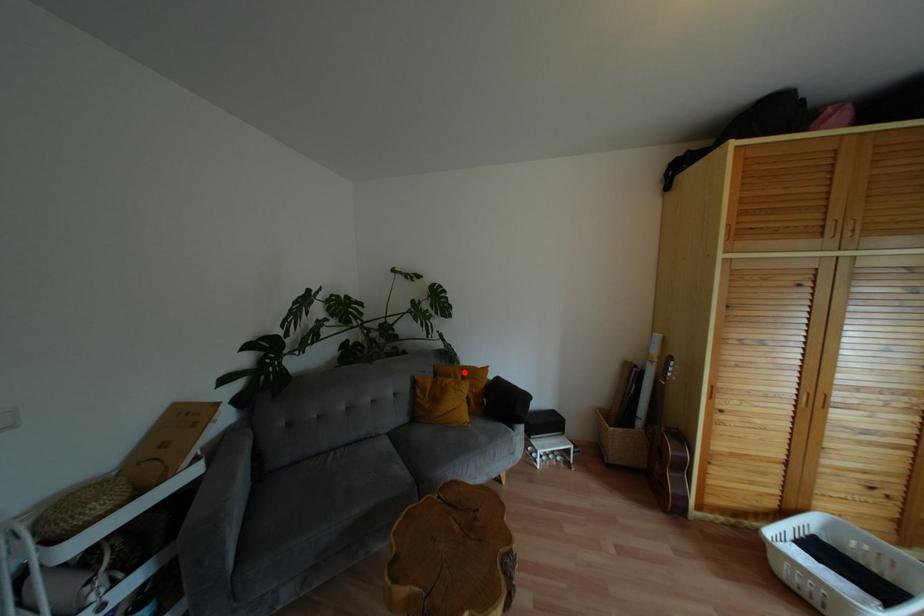
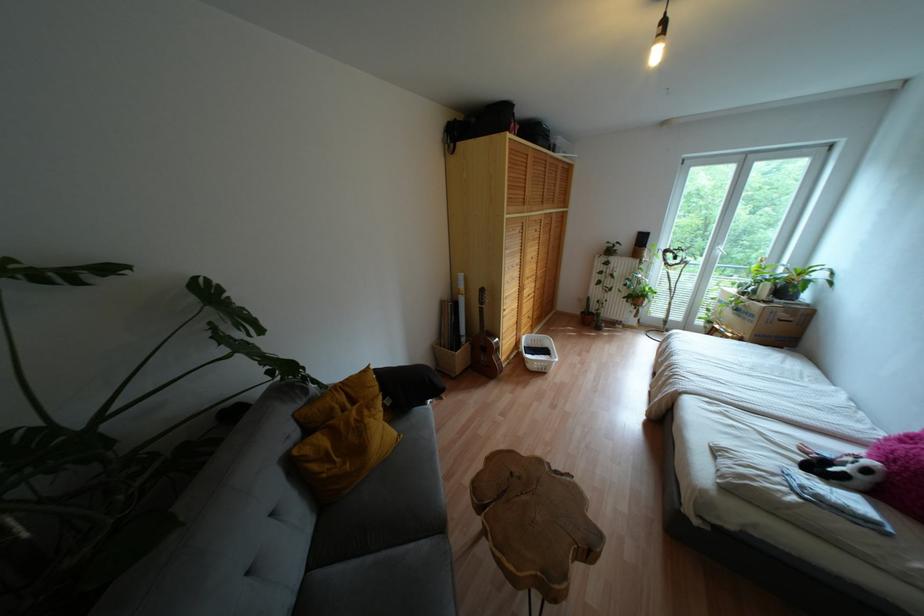
Locate, in the second image, the point that corresponds to the highlighted location in the first image.

(348, 391)